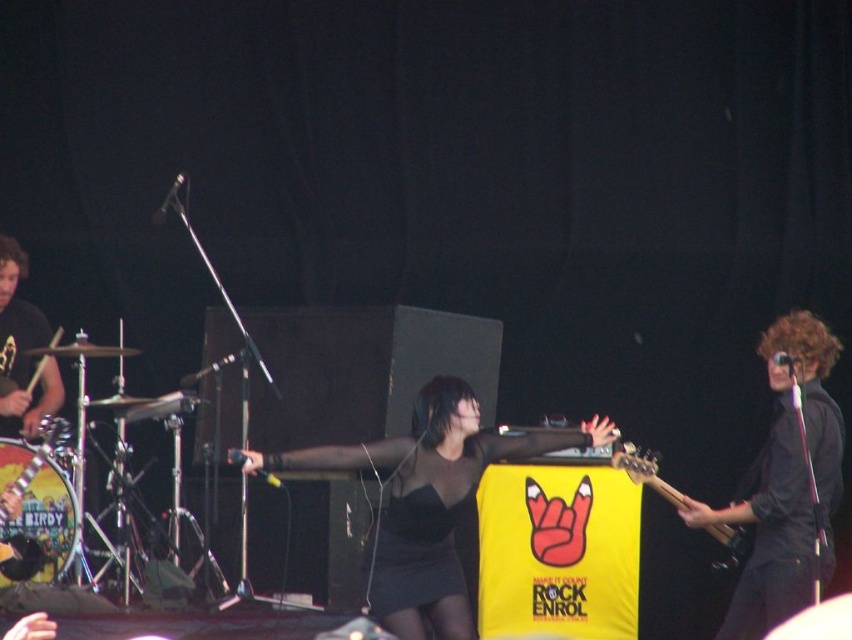
Question: Can you confirm if brushed metal drumsticks at left is positioned above wooden electric guitar at center?

Choices:
 (A) no
 (B) yes

Answer: (B)

Question: Does black matte dress at center have a larger size compared to black matte guitar at right?

Choices:
 (A) no
 (B) yes

Answer: (B)

Question: Estimate the real-world distances between objects in this image. Which object is farther from the black matte dress at center?

Choices:
 (A) brushed metal drum at lower left
 (B) wooden electric guitar at center
 (C) brushed metal drumsticks at left
 (D) black matte guitar at right

Answer: (C)

Question: Which point is farther from the camera taking this photo?

Choices:
 (A) (810, 563)
 (B) (4, 348)
 (C) (22, 508)
 (D) (746, 532)

Answer: (B)

Question: Estimate the real-world distances between objects in this image. Which object is closer to the black matte dress at center?

Choices:
 (A) brushed metal drumsticks at left
 (B) wooden electric guitar at center

Answer: (B)

Question: Is black matte dress at center to the right of brushed metal drumsticks at left from the viewer's perspective?

Choices:
 (A) no
 (B) yes

Answer: (B)